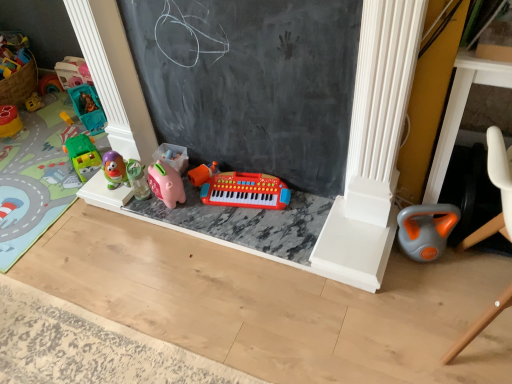
At what (x,y) coordinates should I click in order to perform the action: click on free spot to the left of teal plastic toy truck at left, which ranks as the second toy in left-to-right order. Please return your answer as a coordinate pair (x, y). This screenshot has height=384, width=512. Looking at the image, I should click on (46, 121).